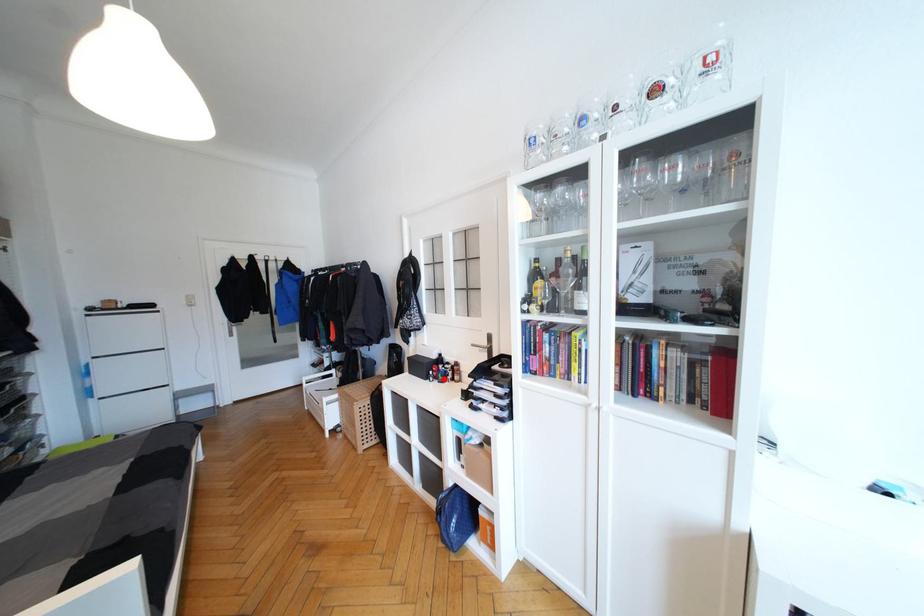
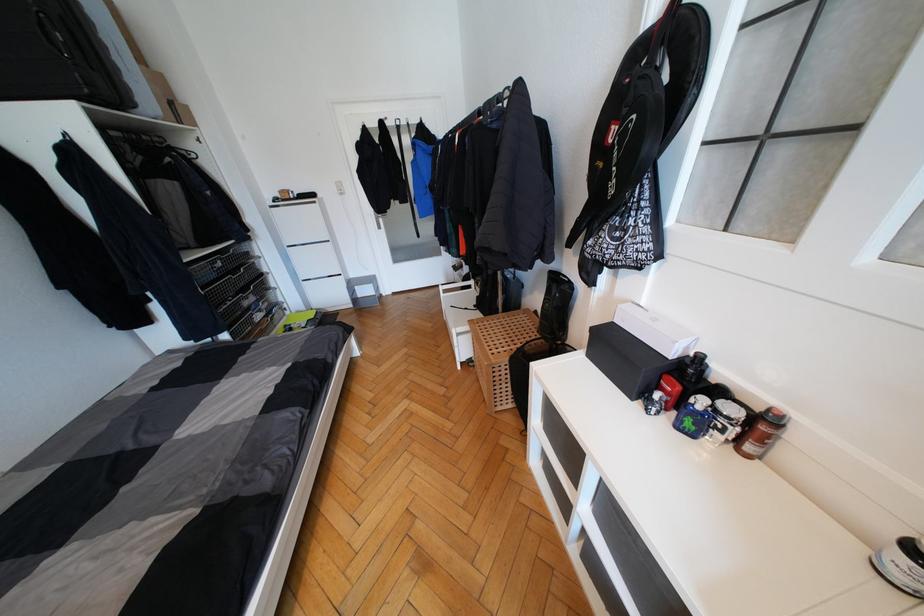
Question: I am providing you with two images of the same scene from different viewpoints. Image1 has a red point marked. In image2, the corresponding 3D location appears at what relative position? Reply with the corresponding letter.

Choices:
 (A) Closer
 (B) Farther

Answer: (A)